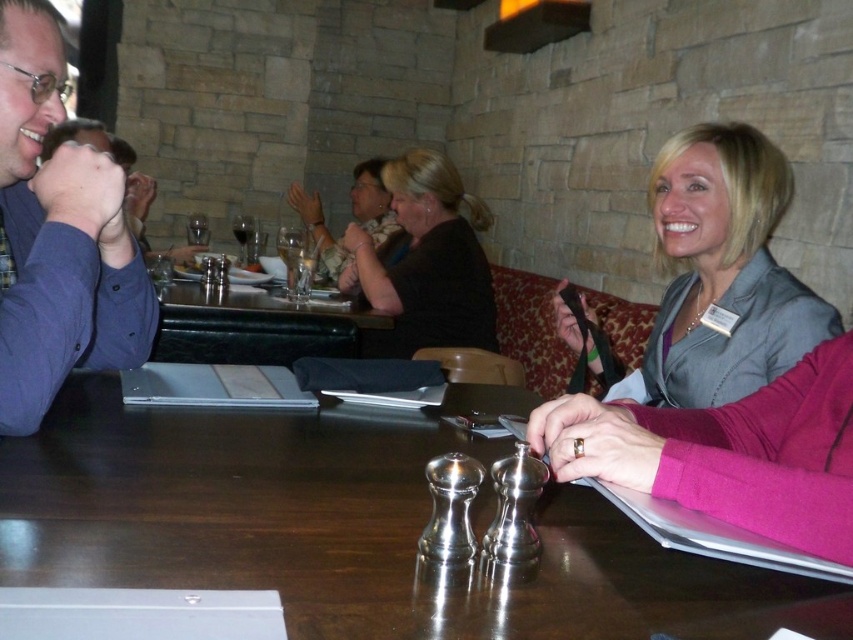
You are a photographer aiming to capture a clear shot of both the matte black jacket at upper center and the transparent glass at upper center. Considering their positions, which object might appear more prominently in the foreground of the photo?

The matte black jacket at upper center is much taller than the transparent glass at upper center, so it will likely appear more prominently in the foreground of the photo.

You are a photographer trying to capture a closeup of the transparent glass wine glass at upper center without including the wooden table at center in the frame. Is this possible given their positions?

The wooden table at center is closer to the viewer than the transparent glass wine glass at upper center, so it would block the view of the glass. Therefore, capturing a closeup of the transparent glass wine glass at upper center without including the wooden table at center is not possible.